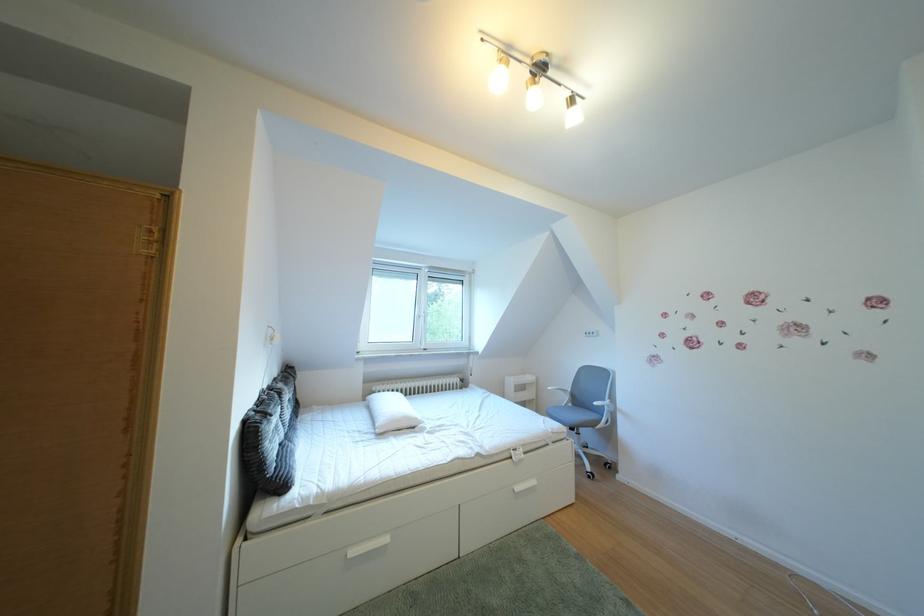
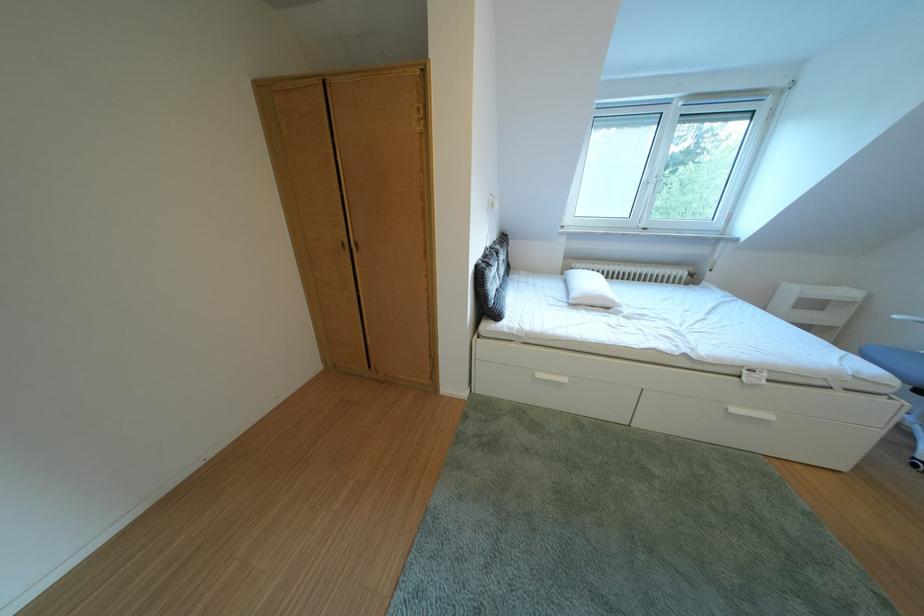
Question: I am providing you with two images of the same scene from different viewpoints. Please identify which objects are invisible in image2.

Choices:
 (A) dark cushion
 (B) window handle
 (C) cabinet handle
 (D) none of these

Answer: (D)